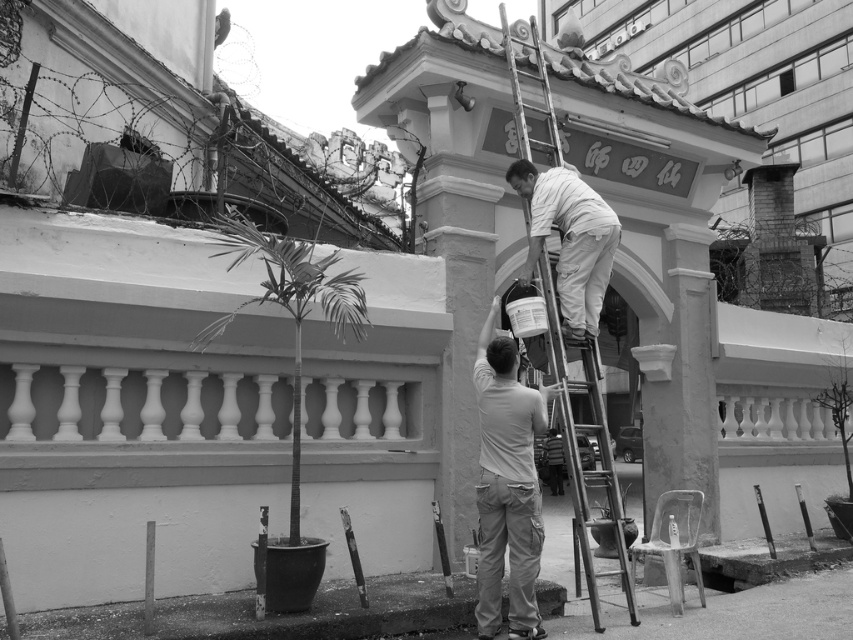
Who is shorter, metallic silver ladder at center or white matte paint canister at upper center?

Standing shorter between the two is metallic silver ladder at center.

Can you confirm if metallic silver ladder at center is taller than white matte paint canister at upper center?

No, metallic silver ladder at center is not taller than white matte paint canister at upper center.

The height and width of the screenshot is (640, 853). Identify the location of metallic silver ladder at center. (575, 452).

Can you confirm if light gray cotton shirt at center is positioned below metallic silver ladder at center?

No.

Which of these two, light gray cotton shirt at center or metallic silver ladder at center, stands shorter?

metallic silver ladder at center is shorter.

Between point (526, 586) and point (616, 524), which one is positioned behind?

Point (616, 524)

Identify the location of light gray cotton shirt at center. (508, 484).

Is light gray cotton shirt at center behind white matte paint canister at upper center?

No, light gray cotton shirt at center is in front of white matte paint canister at upper center.

Who is lower down, light gray cotton shirt at center or white matte paint canister at upper center?

light gray cotton shirt at center

Is point (498, 449) closer to camera compared to point (576, 180)?

Yes, it is in front of point (576, 180).

Find the location of a particular element. light gray cotton shirt at center is located at coordinates (508, 484).